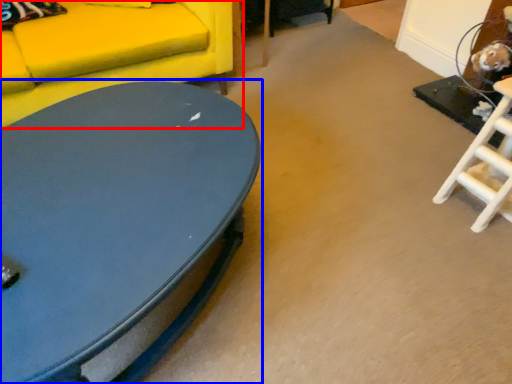
Question: Which of the following is the closest to the observer, studio couch (highlighted by a red box) or coffee table (highlighted by a blue box)?

Choices:
 (A) studio couch
 (B) coffee table

Answer: (B)